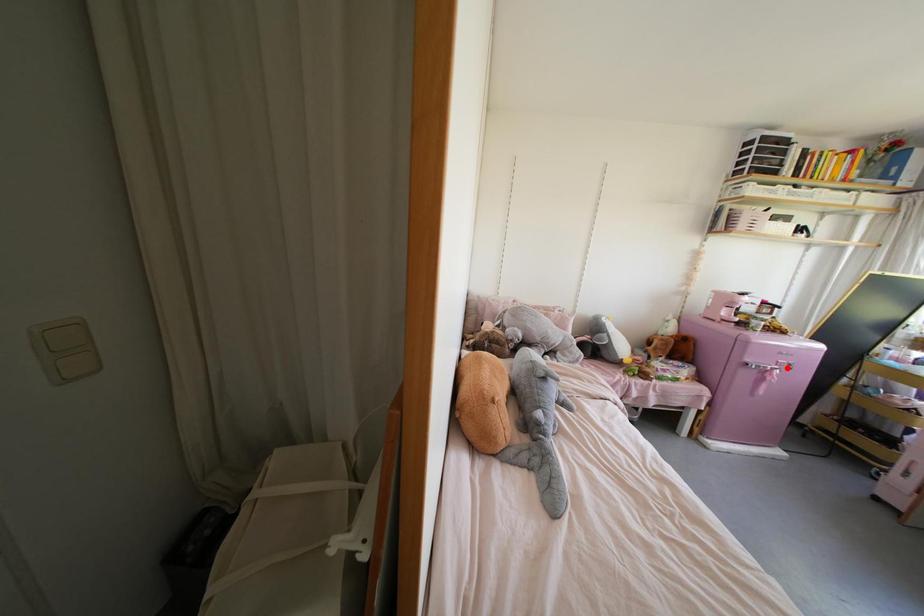
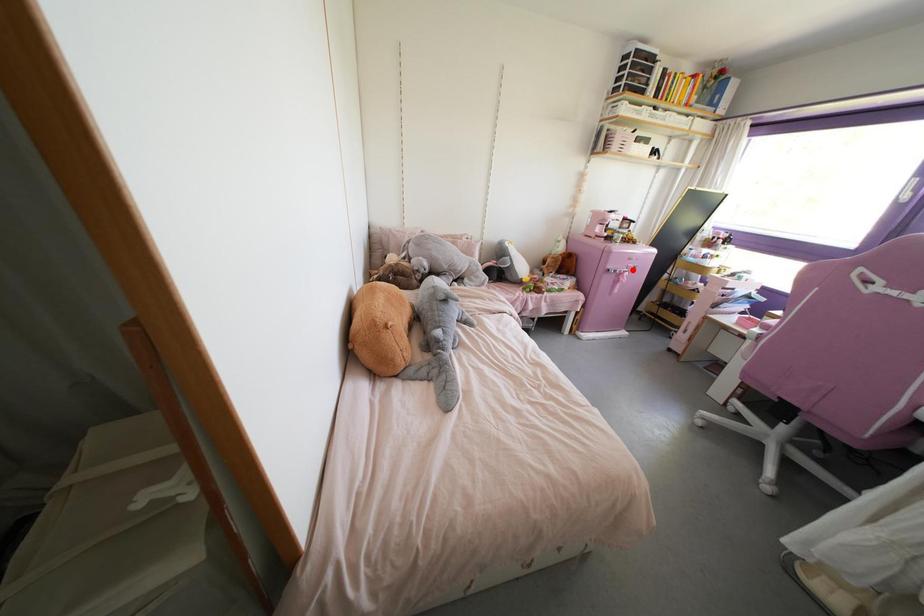
I am providing you with two images of the same scene from different viewpoints. A red point is marked on the first image and another point is marked on the second image. Are the points marked in image1 and image2 representing the same 3D position?

Yes